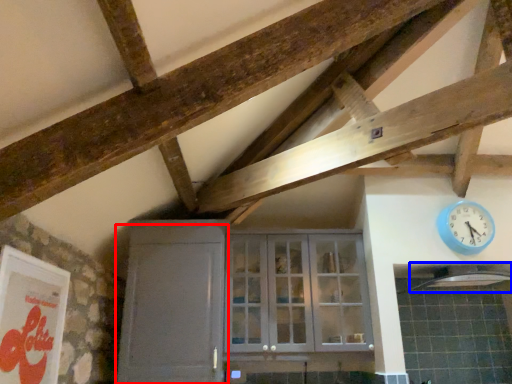
Question: Which point is closer to the camera, door (highlighted by a red box) or exhaust hood (highlighted by a blue box)?

Choices:
 (A) door
 (B) exhaust hood

Answer: (A)